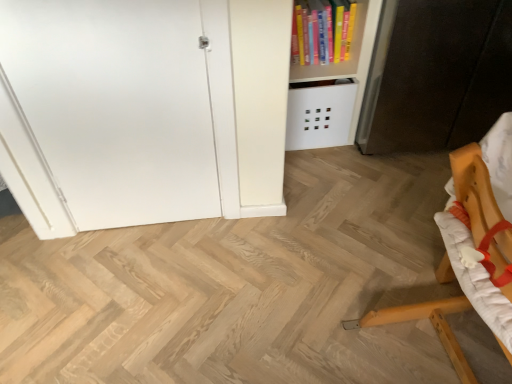
Find the location of a particular element. Image resolution: width=512 pixels, height=384 pixels. free space in front of white matte door at left is located at coordinates (140, 283).